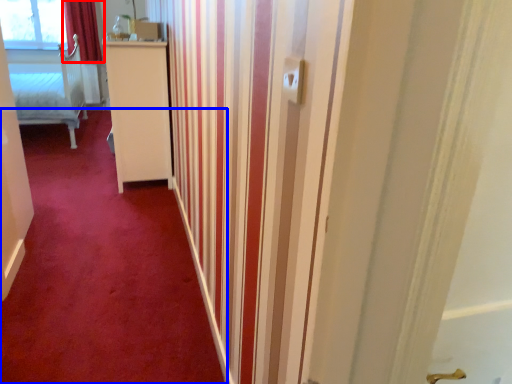
Question: Which object appears closest to the camera in this image, curtain (highlighted by a red box) or plain (highlighted by a blue box)?

Choices:
 (A) curtain
 (B) plain

Answer: (B)